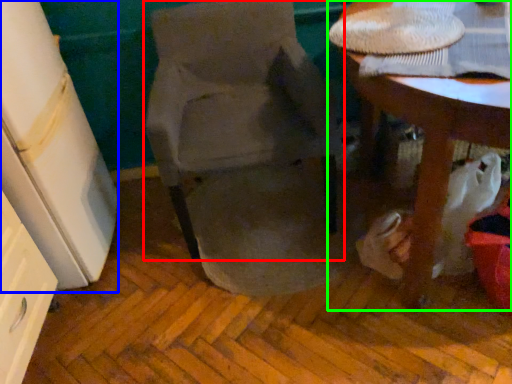
Question: Which is farther away from chair (highlighted by a red box)? leftover (highlighted by a blue box) or table (highlighted by a green box)?

Choices:
 (A) leftover
 (B) table

Answer: (B)